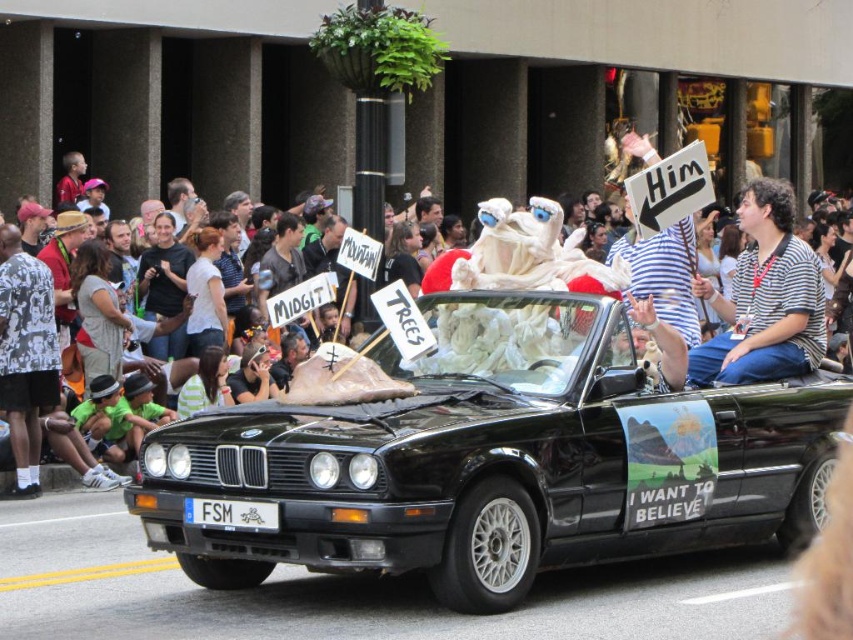
Looking at this image, you are a photographer trying to capture the white plastic fsm at center and the white cotton crowd at center in a single shot. Based on their positions, which object should you focus on first to ensure both are in frame?

The white plastic fsm at center is in front of the white cotton crowd at center, so you should focus on the white plastic fsm at center first to ensure both are in frame.

You are a parade attendee holding a 2.5 feet wide sign. You want to walk from the white cotton crowd at center to the black matte convertible at center to show your sign. Is there enough space between them for you to approach the car?

The distance between the black matte convertible at center and the white cotton crowd at center is 7.78 feet. Since the sign is 2.5 feet wide, you have sufficient space to approach the car as the distance is greater than the sign width.